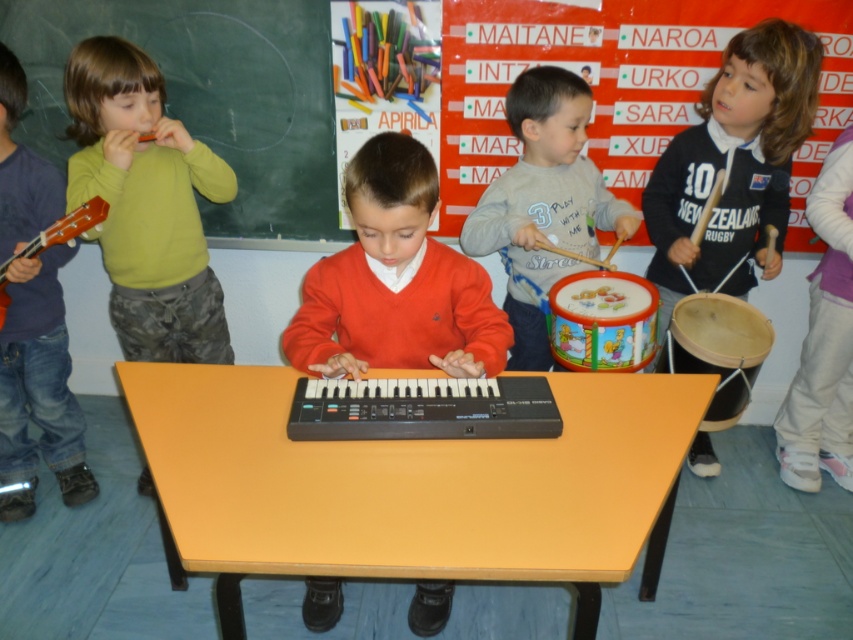
Question: Which point appears closest to the camera in this image?

Choices:
 (A) (215, 484)
 (B) (25, 422)
 (C) (373, 296)
 (D) (245, 20)

Answer: (A)

Question: Is green matte shirt at left below black jersey at right?

Choices:
 (A) no
 (B) yes

Answer: (B)

Question: Is multicolored markers at upper center to the right of wooden drum at right from the viewer's perspective?

Choices:
 (A) no
 (B) yes

Answer: (A)

Question: Considering the real-world distances, which object is closest to the matte orange sweater at center?

Choices:
 (A) wooden drum at right
 (B) gray cotton shirt at center
 (C) yellow wood table at center

Answer: (C)

Question: Is multicolored markers at upper center closer to the viewer compared to black jersey at right?

Choices:
 (A) no
 (B) yes

Answer: (A)

Question: Which object is positioned farthest from the multicolored plastic drum at center?

Choices:
 (A) gray cotton shirt at center
 (B) blackboard at upper left

Answer: (B)